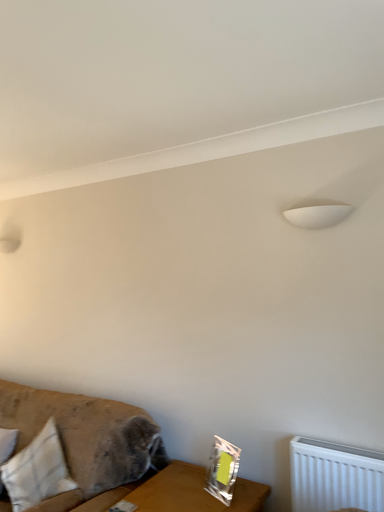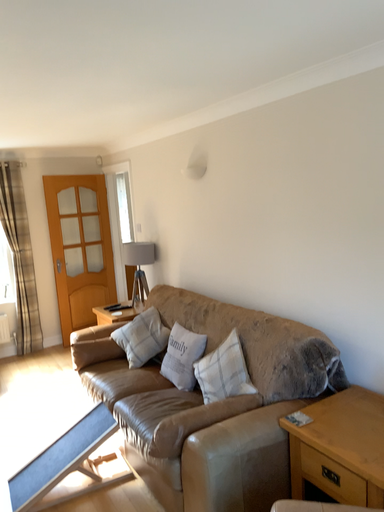
Question: Which way did the camera rotate in the video?

Choices:
 (A) rotated left
 (B) rotated right

Answer: (A)